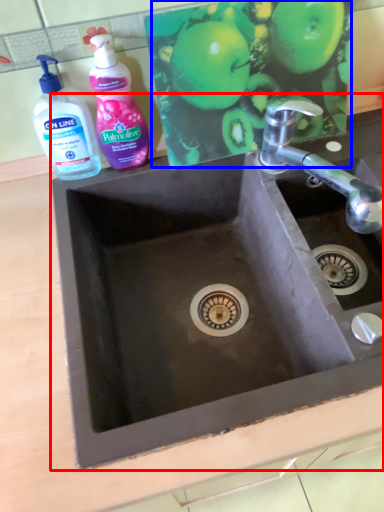
Question: Which point is further to the camera, sink (highlighted by a red box) or apple (highlighted by a blue box)?

Choices:
 (A) sink
 (B) apple

Answer: (B)